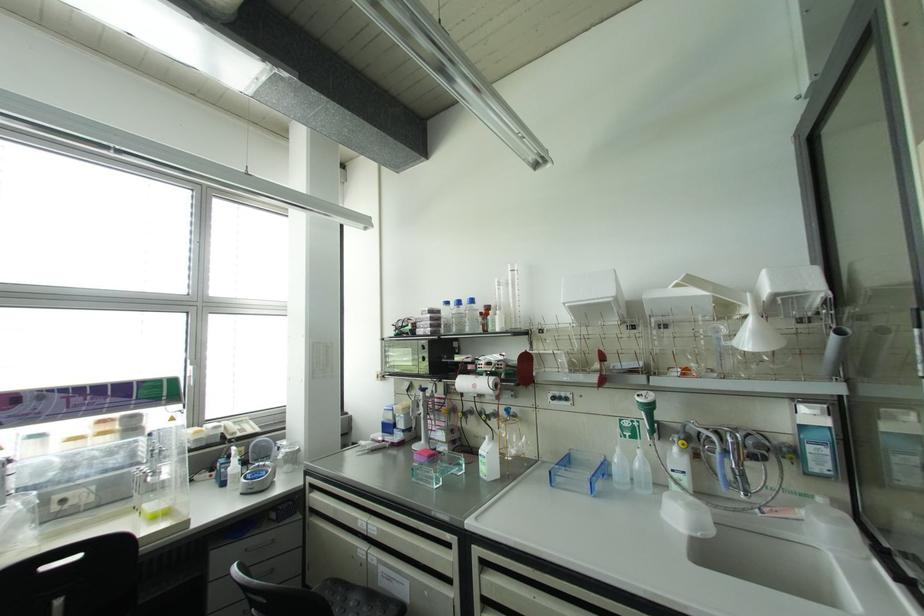
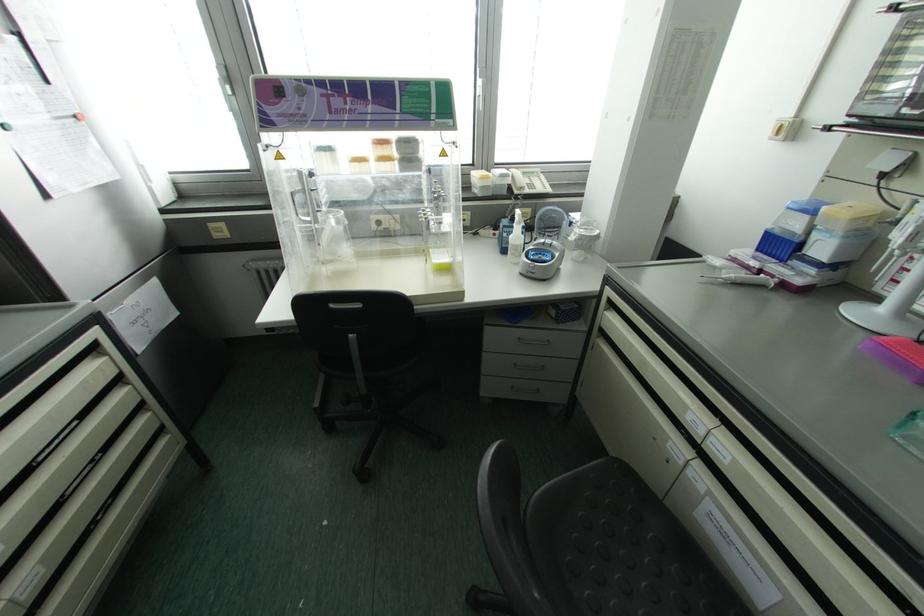
In the second image, find the point that corresponds to pixel 387 427 in the first image.

(777, 245)